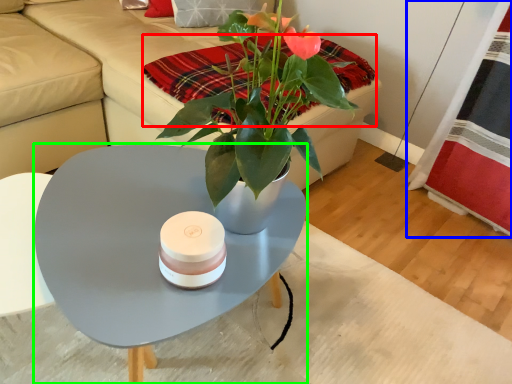
Question: Considering the real-world distances, which object is farthest from blanket (highlighted by a red box)? plaid (highlighted by a blue box) or coffee table (highlighted by a green box)?

Choices:
 (A) plaid
 (B) coffee table

Answer: (A)